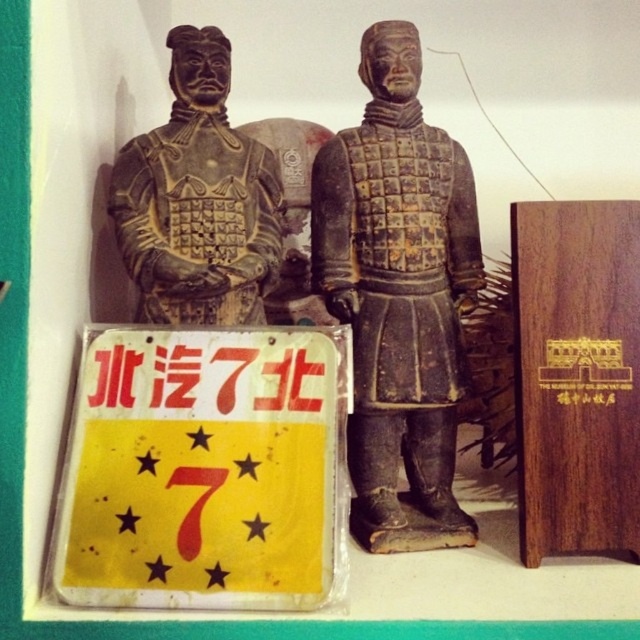
Between yellow plastic sign at lower left and matte black armor at left, which one has more height?

matte black armor at left is taller.

Does yellow plastic sign at lower left have a greater height compared to matte black armor at left?

In fact, yellow plastic sign at lower left may be shorter than matte black armor at left.

Which is in front, point (241, 380) or point (225, 77)?

Positioned in front is point (241, 380).

Locate an element on the screen. The height and width of the screenshot is (640, 640). yellow plastic sign at lower left is located at coordinates (204, 470).

From the picture: Does yellow plastic sign at lower left have a greater height compared to brown matte armor at center?

No.

Which is more to the left, yellow plastic sign at lower left or brown matte armor at center?

yellow plastic sign at lower left is more to the left.

This screenshot has height=640, width=640. Describe the element at coordinates (204, 470) in the screenshot. I see `yellow plastic sign at lower left` at that location.

The height and width of the screenshot is (640, 640). What are the coordinates of `yellow plastic sign at lower left` in the screenshot? It's located at (204, 470).

Looking at this image, can you confirm if brown matte armor at center is positioned to the left of matte black armor at left?

Incorrect, brown matte armor at center is not on the left side of matte black armor at left.

Between brown matte armor at center and matte black armor at left, which one has more height?

With more height is brown matte armor at center.

Is point (387, 476) in front of point (134, 256)?

No, (387, 476) is further to viewer.

Where is `brown matte armor at center`? Image resolution: width=640 pixels, height=640 pixels. brown matte armor at center is located at coordinates (397, 296).